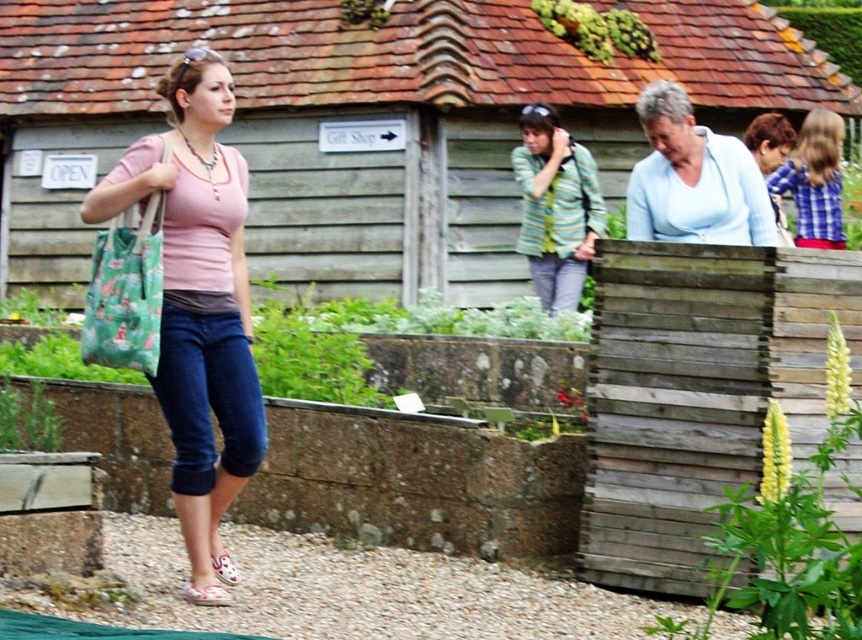
You are standing at the entrance of the garden and want to reach the wooden fence at center. Which direction should you walk to get there?

The wooden fence at center is located at point 0.194 on the x and 0.423 on the y axis, so you should walk towards the center of the image to reach it.

You are a photographer trying to capture a photo of the matte pink shirt at center and the wooden fence at center. Based on their positions, which object should you focus on first if you want to include both in your frame without moving the camera?

The wooden fence at center is positioned on the right side of matte pink shirt at center, so you should focus on the matte pink shirt at center first to ensure both are in the frame without moving the camera.